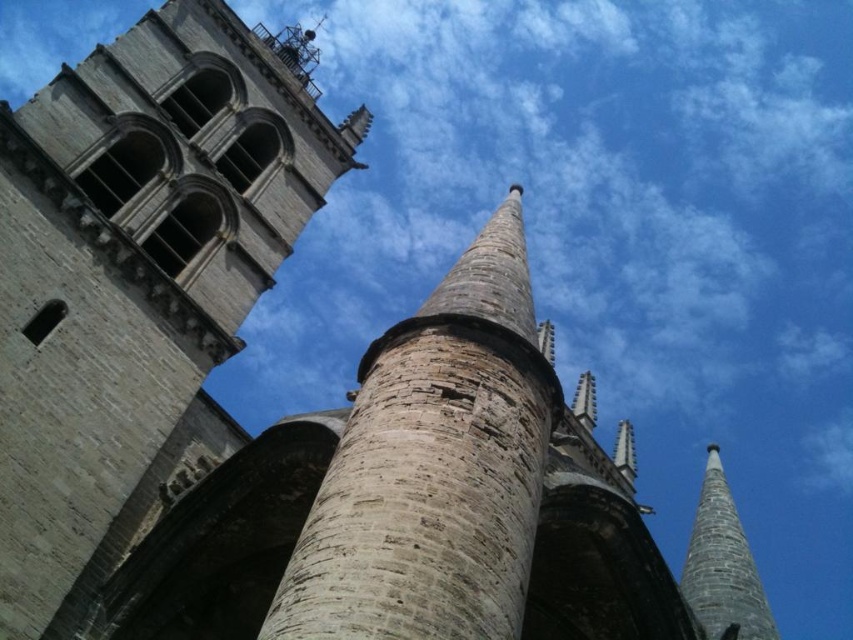
You are an architect examining the cathedral. You notice the stone textured pillar at center and the smooth gray stone spire at right. Which of these two objects is positioned higher in the image?

The stone textured pillar at center is located above the smooth gray stone spire at right, so it is positioned higher in the image.

You are an architect analyzing the historic stone structure. You observe the stone tower at center and the stone textured pillar at center. Which of these two objects is significantly taller?

The stone tower at center is much taller than the stone textured pillar at center.